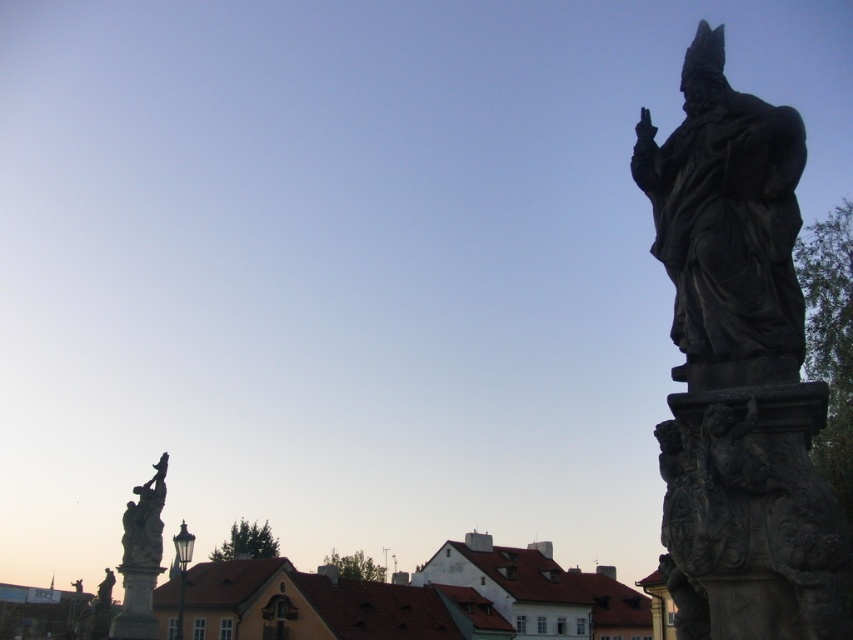
You are an architect designing a new building that needs to respect the historical skyline. The brown tiled roofs at lower center and the dark gray stone statue at right are part of the protected area. Which of these two objects is taller and must be considered in the height restrictions for the new building?

The brown tiled roofs at lower center is taller than the dark gray stone statue at right, so it must be considered in the height restrictions for the new building.